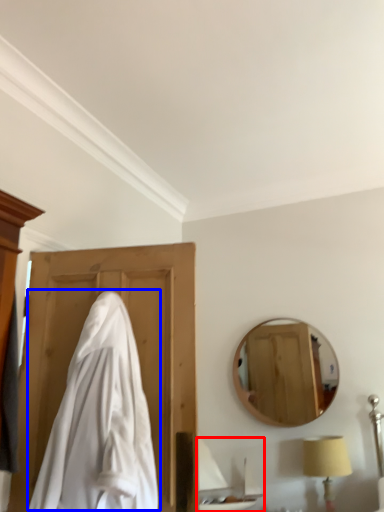
Question: Which point is further to the camera, sink (highlighted by a red box) or cloak (highlighted by a blue box)?

Choices:
 (A) sink
 (B) cloak

Answer: (A)